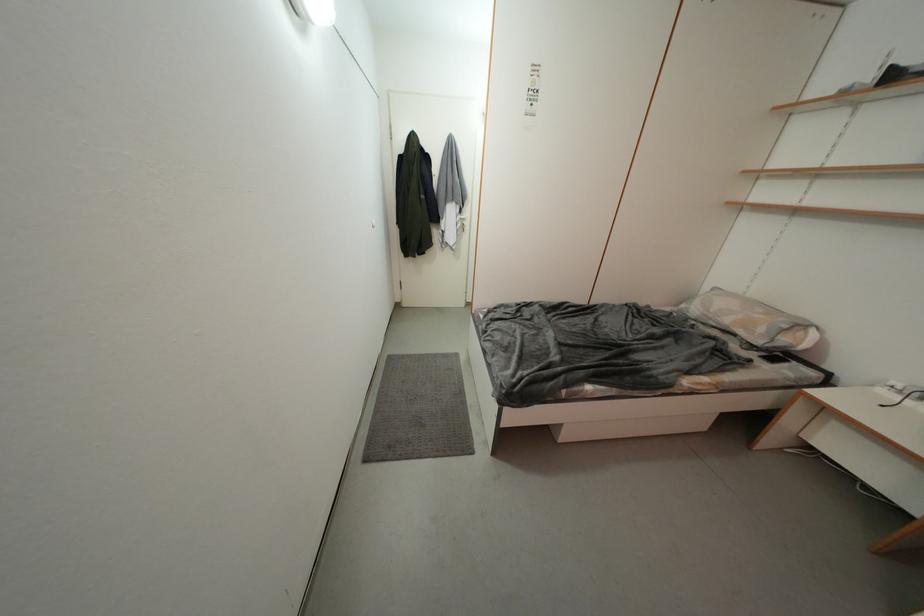
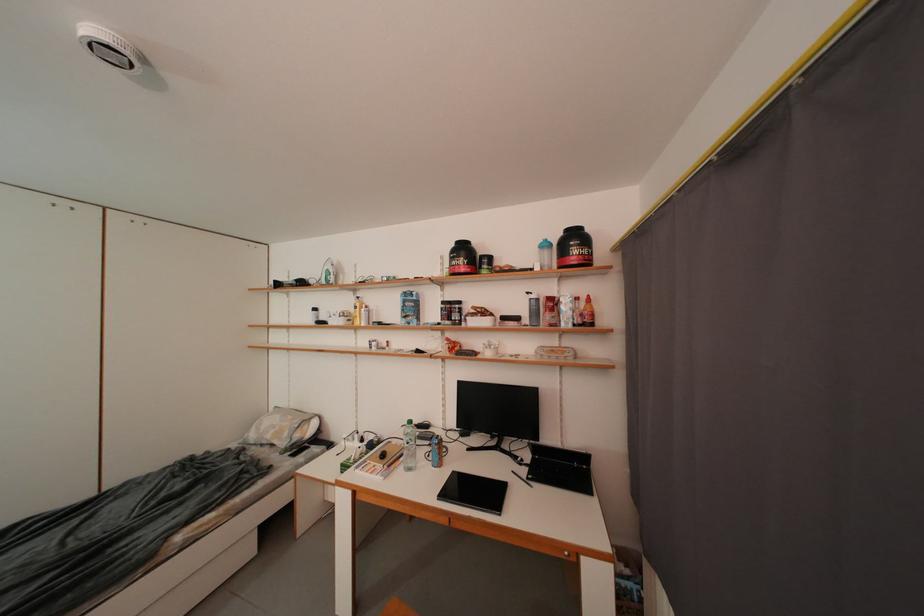
Where in the second image is the point corresponding to the point at 769,333 from the first image?

(294, 438)